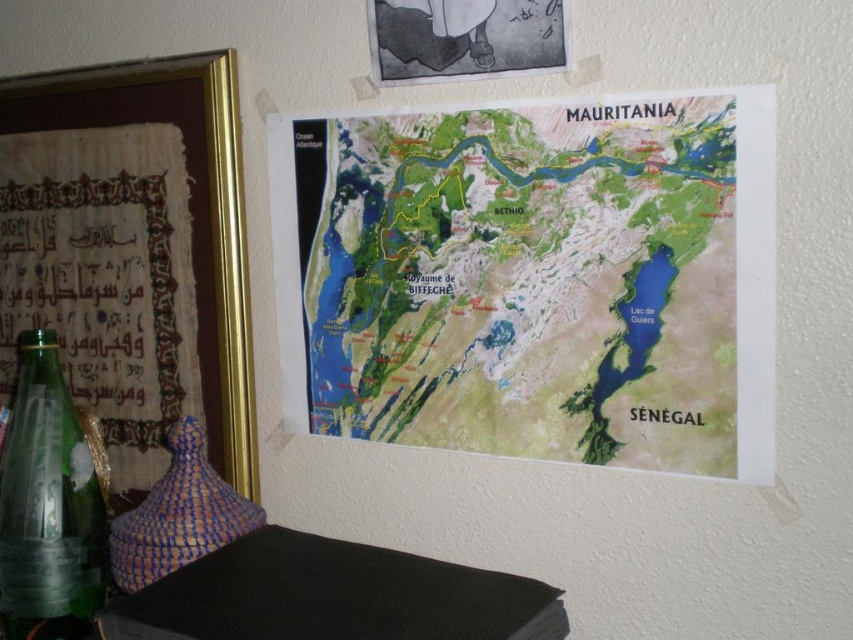
Question: Which point is farther from the camera taking this photo?

Choices:
 (A) (44, 422)
 (B) (165, 67)
 (C) (357, 252)
 (D) (254, 536)

Answer: (B)

Question: Estimate the real-world distances between objects in this image. Which object is closer to the green paper map at upper center?

Choices:
 (A) gold-framed picture at left
 (B) transparent glass bottle at lower left
 (C) black matte book at lower left

Answer: (C)

Question: Which object is closer to the camera taking this photo?

Choices:
 (A) green paper map at upper center
 (B) transparent glass bottle at lower left
 (C) black matte book at lower left
 (D) gold-framed picture at left

Answer: (C)

Question: Considering the relative positions of black matte book at lower left and transparent glass bottle at lower left in the image provided, where is black matte book at lower left located with respect to transparent glass bottle at lower left?

Choices:
 (A) below
 (B) above

Answer: (A)

Question: Considering the relative positions of green paper map at upper center and gold-framed picture at left in the image provided, where is green paper map at upper center located with respect to gold-framed picture at left?

Choices:
 (A) below
 (B) above

Answer: (A)

Question: Is gold-framed picture at left above transparent glass bottle at lower left?

Choices:
 (A) no
 (B) yes

Answer: (B)